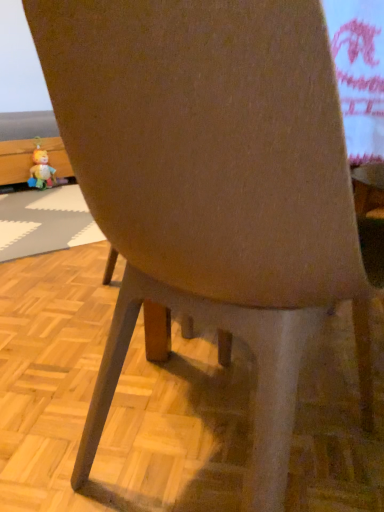
Identify the location of vacant space in front of plush yellow toy at left. (38, 197).